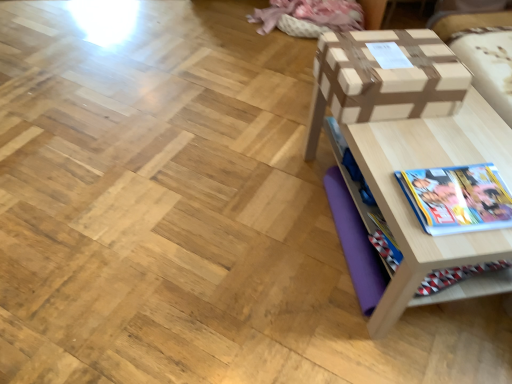
Question: Is hardcover book at lower right wider than wooden table at right?

Choices:
 (A) yes
 (B) no

Answer: (B)

Question: Are hardcover book at lower right and wooden table at right beside each other?

Choices:
 (A) yes
 (B) no

Answer: (B)

Question: Can you confirm if hardcover book at lower right is shorter than wooden table at right?

Choices:
 (A) yes
 (B) no

Answer: (A)

Question: From a real-world perspective, is hardcover book at lower right under wooden table at right?

Choices:
 (A) yes
 (B) no

Answer: (B)

Question: Is hardcover book at lower right outside wooden table at right?

Choices:
 (A) yes
 (B) no

Answer: (B)

Question: Is hardcover book at lower right in front of wooden table at right?

Choices:
 (A) yes
 (B) no

Answer: (B)

Question: Would you say wooden table at right is a long distance from hardcover book at lower right?

Choices:
 (A) no
 (B) yes

Answer: (A)

Question: Is wooden table at right positioned beyond the bounds of hardcover book at lower right?

Choices:
 (A) yes
 (B) no

Answer: (A)

Question: From a real-world perspective, is wooden table at right over hardcover book at lower right?

Choices:
 (A) yes
 (B) no

Answer: (B)

Question: Is hardcover book at lower right a part of wooden table at right?

Choices:
 (A) yes
 (B) no

Answer: (A)

Question: From a real-world perspective, is wooden table at right under hardcover book at lower right?

Choices:
 (A) no
 (B) yes

Answer: (B)

Question: Is wooden table at right at the right side of hardcover book at lower right?

Choices:
 (A) yes
 (B) no

Answer: (A)

Question: Can you confirm if brown cardboard box at upper right is shorter than wooden table at right?

Choices:
 (A) no
 (B) yes

Answer: (B)